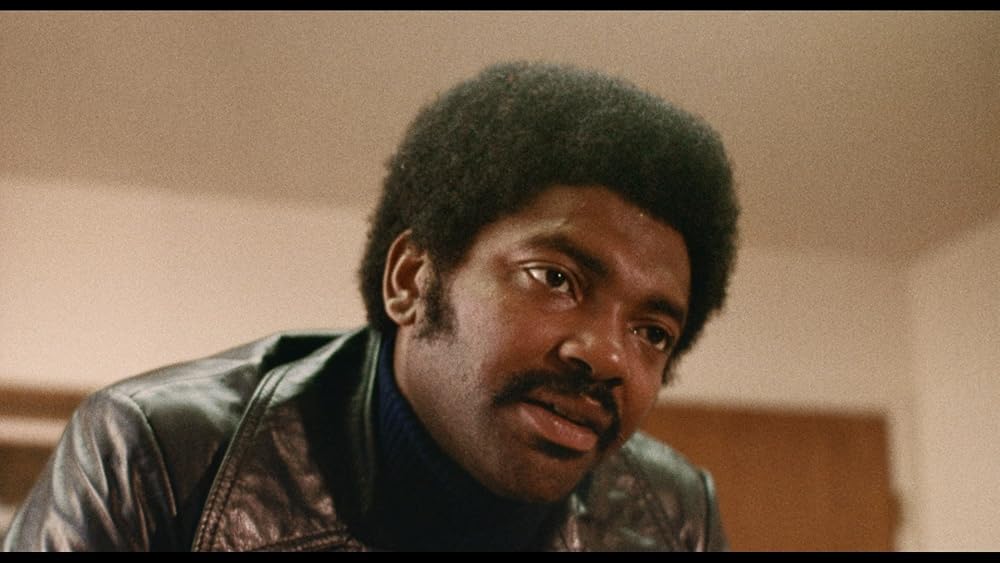
The image size is (1000, 563). Find the location of `wall`. wall is located at coordinates (201, 272).